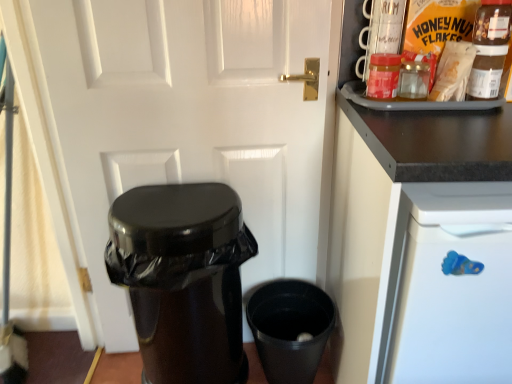
Question: From the image's perspective, is matte brown paper bag at upper right, acting as the 2th food starting from the back, beneath matte plastic jar at upper right?

Choices:
 (A) yes
 (B) no

Answer: (B)

Question: Is matte brown paper bag at upper right, acting as the 2th food starting from the back, facing towards matte plastic jar at upper right?

Choices:
 (A) yes
 (B) no

Answer: (B)

Question: Is matte brown paper bag at upper right, acting as the 2th food starting from the back, to the left of matte plastic jar at upper right from the viewer's perspective?

Choices:
 (A) no
 (B) yes

Answer: (A)

Question: Is matte brown paper bag at upper right, acting as the 2th food starting from the back, outside of matte plastic jar at upper right?

Choices:
 (A) no
 (B) yes

Answer: (B)

Question: Can you confirm if matte brown paper bag at upper right, the first food in the front-to-back sequence, is positioned to the right of matte plastic jar at upper right?

Choices:
 (A) yes
 (B) no

Answer: (A)

Question: In the image, is white glossy door at center on the left side or the right side of black matte cabinet at upper right?

Choices:
 (A) right
 (B) left

Answer: (B)

Question: From a real-world perspective, is white glossy door at center physically located above or below black matte cabinet at upper right?

Choices:
 (A) above
 (B) below

Answer: (A)

Question: From their relative heights in the image, would you say white glossy door at center is taller or shorter than black matte cabinet at upper right?

Choices:
 (A) tall
 (B) short

Answer: (A)

Question: Is point tap(230, 87) closer or farther from the camera than point tap(454, 276)?

Choices:
 (A) farther
 (B) closer

Answer: (A)

Question: From a real-world perspective, relative to white glossy door at center, is black plastic cup at lower right vertically above or below?

Choices:
 (A) below
 (B) above

Answer: (A)

Question: In the image, is black plastic cup at lower right positioned in front of or behind white glossy door at center?

Choices:
 (A) behind
 (B) front

Answer: (A)

Question: Do you think black plastic cup at lower right is within white glossy door at center, or outside of it?

Choices:
 (A) outside
 (B) inside

Answer: (A)

Question: In terms of height, does black plastic cup at lower right look taller or shorter compared to white glossy door at center?

Choices:
 (A) short
 (B) tall

Answer: (A)

Question: Is matte brown paper bag at upper right, acting as the 2th food starting from the back, bigger or smaller than black glossy trash can at lower left?

Choices:
 (A) big
 (B) small

Answer: (B)

Question: Which is correct: matte brown paper bag at upper right, the first food in the front-to-back sequence, is inside black glossy trash can at lower left, or outside of it?

Choices:
 (A) inside
 (B) outside

Answer: (B)